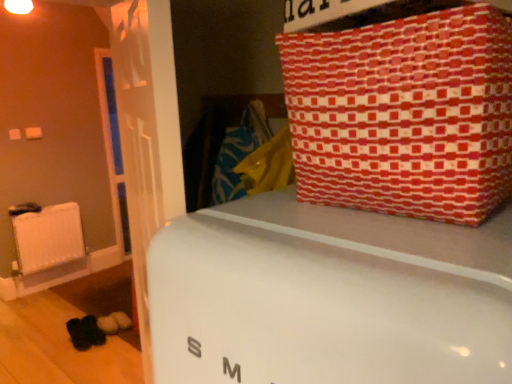
The width and height of the screenshot is (512, 384). Identify the location of white glossy refrigerator at center. (328, 296).

This screenshot has height=384, width=512. What are the coordinates of `red patterned fabric at upper right` in the screenshot? It's located at (404, 114).

In order to click on white glossy refrigerator at center in this screenshot , I will do click(x=328, y=296).

Which object is wider, white matte radiator at left or white glossy refrigerator at center?

white glossy refrigerator at center is wider.

Looking at this image, from the image's perspective, which one is positioned lower, white matte radiator at left or white glossy refrigerator at center?

white matte radiator at left, from the image's perspective.

In the image, is white matte radiator at left positioned in front of or behind white glossy refrigerator at center?

Visually, white matte radiator at left is located behind white glossy refrigerator at center.

Is point (320, 230) closer to camera compared to point (374, 173)?

Yes, it is.

Considering the relative sizes of white glossy refrigerator at center and red patterned fabric at upper right in the image provided, is white glossy refrigerator at center shorter than red patterned fabric at upper right?

In fact, white glossy refrigerator at center may be taller than red patterned fabric at upper right.

Where is `furniture on the left of the red patterned fabric at upper right`? This screenshot has width=512, height=384. furniture on the left of the red patterned fabric at upper right is located at coordinates (328, 296).

Relative to red patterned fabric at upper right, is white glossy refrigerator at center in front or behind?

white glossy refrigerator at center is in front of red patterned fabric at upper right.

Where is `package in front of the white matte radiator at left`? Image resolution: width=512 pixels, height=384 pixels. package in front of the white matte radiator at left is located at coordinates (404, 114).

From a real-world perspective, is white matte radiator at left below red patterned fabric at upper right?

Correct, in the physical world, white matte radiator at left is lower than red patterned fabric at upper right.

Between white matte radiator at left and red patterned fabric at upper right, which one is positioned behind?

white matte radiator at left is further away from the camera.

Can you confirm if white matte radiator at left is wider than red patterned fabric at upper right?

Incorrect, the width of white matte radiator at left does not surpass that of red patterned fabric at upper right.

Can you tell me how much red patterned fabric at upper right and white matte radiator at left differ in facing direction?

83.3 degrees separate the facing orientations of red patterned fabric at upper right and white matte radiator at left.

Does red patterned fabric at upper right appear on the right side of white matte radiator at left?

Correct, you'll find red patterned fabric at upper right to the right of white matte radiator at left.

Considering the relative sizes of red patterned fabric at upper right and white matte radiator at left in the image provided, is red patterned fabric at upper right bigger than white matte radiator at left?

Indeed, red patterned fabric at upper right has a larger size compared to white matte radiator at left.

This screenshot has height=384, width=512. Identify the location of radiator behind the red patterned fabric at upper right. (48, 238).

From the image's perspective, between red patterned fabric at upper right and white glossy refrigerator at center, who is located below?

From the image's view, white glossy refrigerator at center is below.

Would you say red patterned fabric at upper right is outside white glossy refrigerator at center?

Yes.

How different are the orientations of red patterned fabric at upper right and white glossy refrigerator at center in degrees?

1.98 degrees.

Considering the relative sizes of red patterned fabric at upper right and white glossy refrigerator at center in the image provided, is red patterned fabric at upper right bigger than white glossy refrigerator at center?

Incorrect, red patterned fabric at upper right is not larger than white glossy refrigerator at center.

Which object is thinner, white glossy refrigerator at center or white matte radiator at left?

white matte radiator at left.

Is white glossy refrigerator at center to the right of white matte radiator at left from the viewer's perspective?

Indeed, white glossy refrigerator at center is positioned on the right side of white matte radiator at left.

Is white glossy refrigerator at center not close to white matte radiator at left?

white glossy refrigerator at center is far away from white matte radiator at left.

Who is taller, white glossy refrigerator at center or white matte radiator at left?

Standing taller between the two is white glossy refrigerator at center.

I want to click on furniture in front of the white matte radiator at left, so click(328, 296).

In the image, there is a white glossy refrigerator at center. At what (x,y) coordinates should I click in order to perform the action: click on package above it (from the image's perspective). Please return your answer as a coordinate pair (x, y). This screenshot has width=512, height=384. Looking at the image, I should click on (404, 114).

Looking at the image, which one is located further to white matte radiator at left, red patterned fabric at upper right or white glossy refrigerator at center?

red patterned fabric at upper right is positioned further to the anchor white matte radiator at left.

Estimate the real-world distances between objects in this image. Which object is further from white glossy refrigerator at center, white matte radiator at left or red patterned fabric at upper right?

The object further to white glossy refrigerator at center is white matte radiator at left.

Based on their spatial positions, is red patterned fabric at upper right or white matte radiator at left further from white glossy refrigerator at center?

Among the two, white matte radiator at left is located further to white glossy refrigerator at center.

Based on their spatial positions, is white glossy refrigerator at center or red patterned fabric at upper right closer to white matte radiator at left?

white glossy refrigerator at center is positioned closer to the anchor white matte radiator at left.

Estimate the real-world distances between objects in this image. Which object is further from red patterned fabric at upper right, white matte radiator at left or white glossy refrigerator at center?

white matte radiator at left lies further to red patterned fabric at upper right than the other object.

When comparing their distances from red patterned fabric at upper right, does white glossy refrigerator at center or white matte radiator at left seem further?

Based on the image, white matte radiator at left appears to be further to red patterned fabric at upper right.

The image size is (512, 384). I want to click on package located between white glossy refrigerator at center and white matte radiator at left in the depth direction, so click(404, 114).